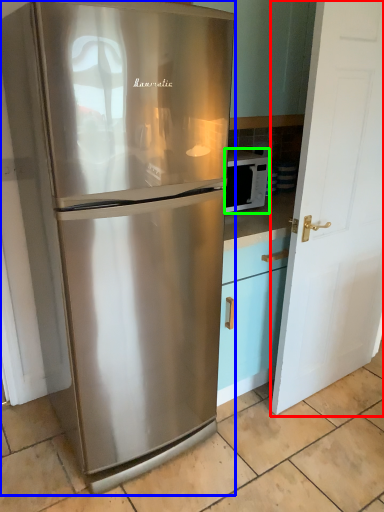
Question: Estimate the real-world distances between objects in this image. Which object is farther from door (highlighted by a red box), refrigerator (highlighted by a blue box) or microwave oven (highlighted by a green box)?

Choices:
 (A) refrigerator
 (B) microwave oven

Answer: (A)